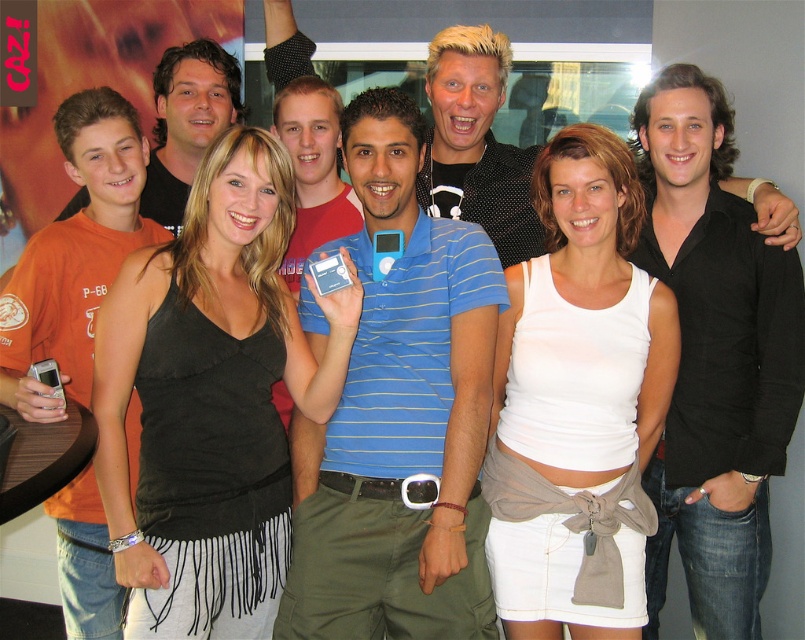
Can you confirm if black fabric tank top at center is wider than blue striped polo shirt at center?

Indeed, black fabric tank top at center has a greater width compared to blue striped polo shirt at center.

Is black fabric tank top at center smaller than blue striped polo shirt at center?

Yes, black fabric tank top at center is smaller than blue striped polo shirt at center.

Which is behind, point (217, 317) or point (484, 442)?

Positioned behind is point (217, 317).

Where is `black fabric tank top at center`? The height and width of the screenshot is (640, 805). black fabric tank top at center is located at coordinates (211, 401).

Does orange cotton t-shirt at left have a larger size compared to shiny black jacket at center?

Correct, orange cotton t-shirt at left is larger in size than shiny black jacket at center.

Between orange cotton t-shirt at left and shiny black jacket at center, which one appears on the left side from the viewer's perspective?

orange cotton t-shirt at left

Locate an element on the screen. This screenshot has width=805, height=640. orange cotton t-shirt at left is located at coordinates (75, 253).

Who is shorter, blue striped polo shirt at center or orange cotton t-shirt at left?

Standing shorter between the two is blue striped polo shirt at center.

Can you confirm if blue striped polo shirt at center is smaller than orange cotton t-shirt at left?

Indeed, blue striped polo shirt at center has a smaller size compared to orange cotton t-shirt at left.

Locate an element on the screen. blue striped polo shirt at center is located at coordinates (398, 413).